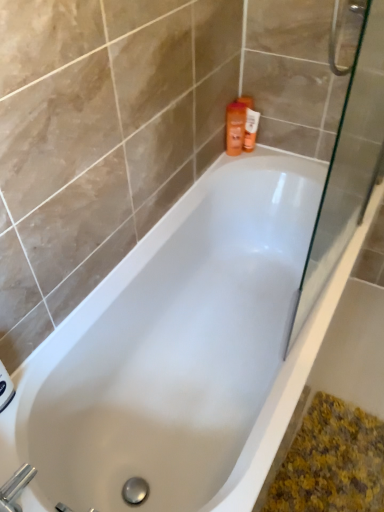
Identify the location of free spot below transparent glass screen door at right (from a real-world perspective). (345, 258).